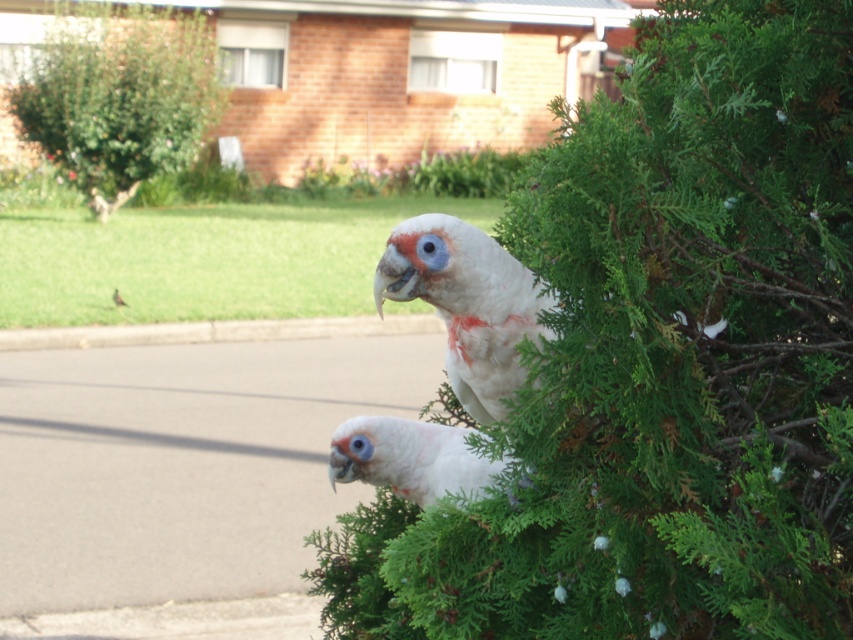
You are standing in the suburban area shown in the image. You want to locate the green leafy bush at upper left. Which direction should you face to see it?

You should face the upper left direction to see the green leafy bush at upper left, as it is located at point coordinates of [119,99].

You are a birdwatcher standing on the paved road and see the green leafy bush at upper left and the white feathered bird at upper center. Which object is higher in the image?

The green leafy bush at upper left is positioned over the white feathered bird at upper center, so it is higher in the image.